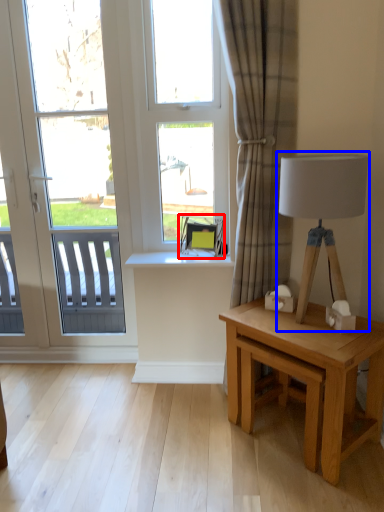
Question: Which point is closer to the camera, swivel chair (highlighted by a red box) or table lamp (highlighted by a blue box)?

Choices:
 (A) swivel chair
 (B) table lamp

Answer: (B)